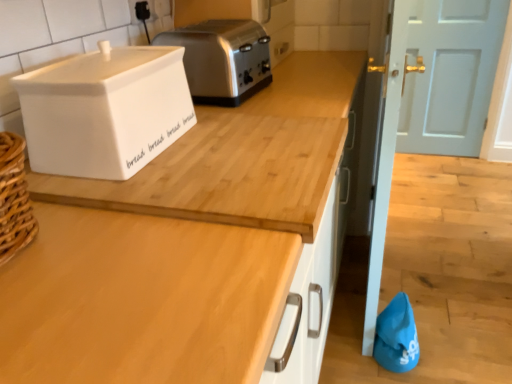
In order to click on free location in front of white ceramic bread bin at upper left in this screenshot , I will do `click(144, 181)`.